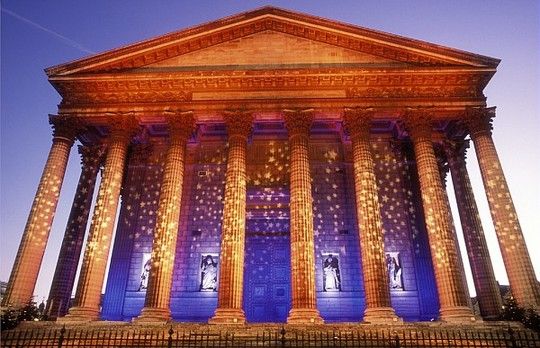
Find the location of a particular element. The image size is (540, 348). light is located at coordinates (234, 234).